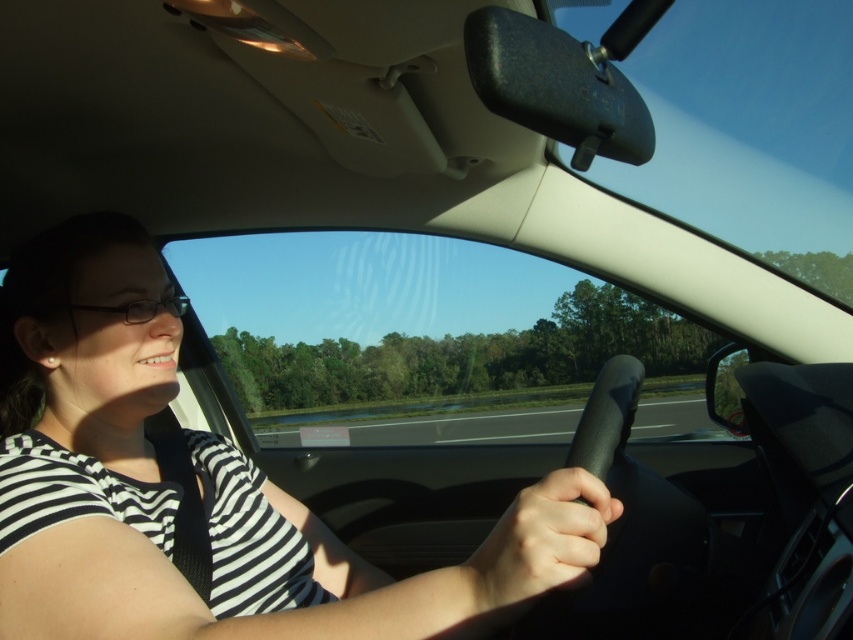
Question: Which point appears farthest from the camera in this image?

Choices:
 (A) click(148, 308)
 (B) click(312, 593)
 (C) click(486, 442)

Answer: (C)

Question: Can you confirm if white striped shirt at center is thinner than clear plastic glasses at left?

Choices:
 (A) yes
 (B) no

Answer: (B)

Question: Observing the image, what is the correct spatial positioning of white striped shirt at center in reference to clear plastic glasses at left?

Choices:
 (A) above
 (B) below

Answer: (B)

Question: Is asphalt road at center below clear plastic glasses at left?

Choices:
 (A) yes
 (B) no

Answer: (A)

Question: Which of the following is the closest to the observer?

Choices:
 (A) white striped shirt at center
 (B) clear plastic glasses at left
 (C) asphalt road at center

Answer: (A)

Question: Estimate the real-world distances between objects in this image. Which object is farther from the asphalt road at center?

Choices:
 (A) white striped shirt at center
 (B) clear plastic glasses at left

Answer: (B)